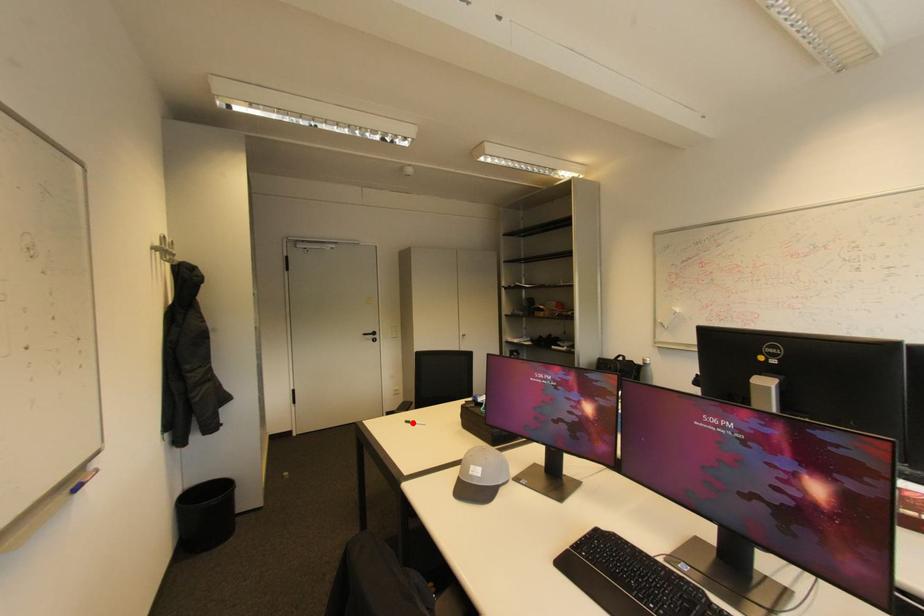
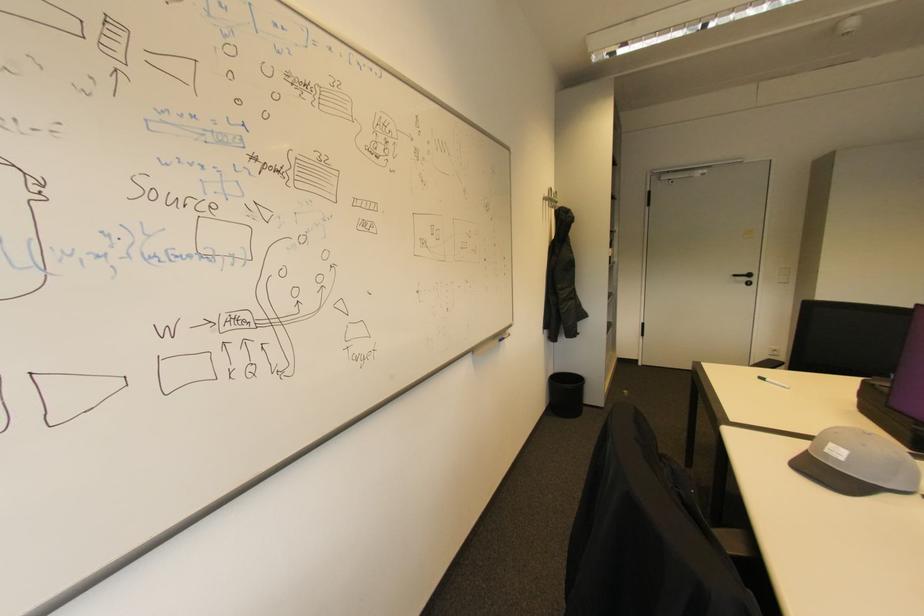
The point at the highlighted location is marked in the first image. Where is the corresponding point in the second image?

(768, 379)